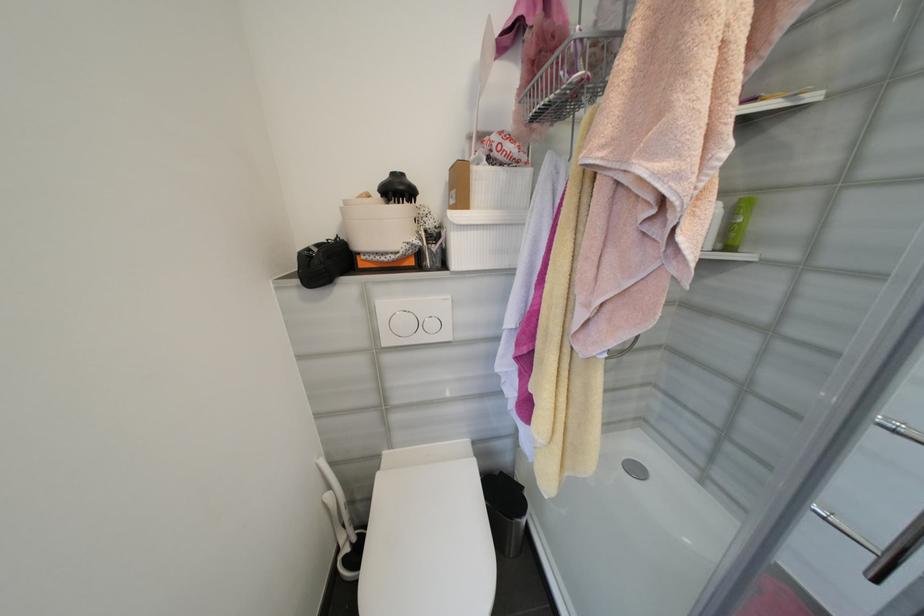
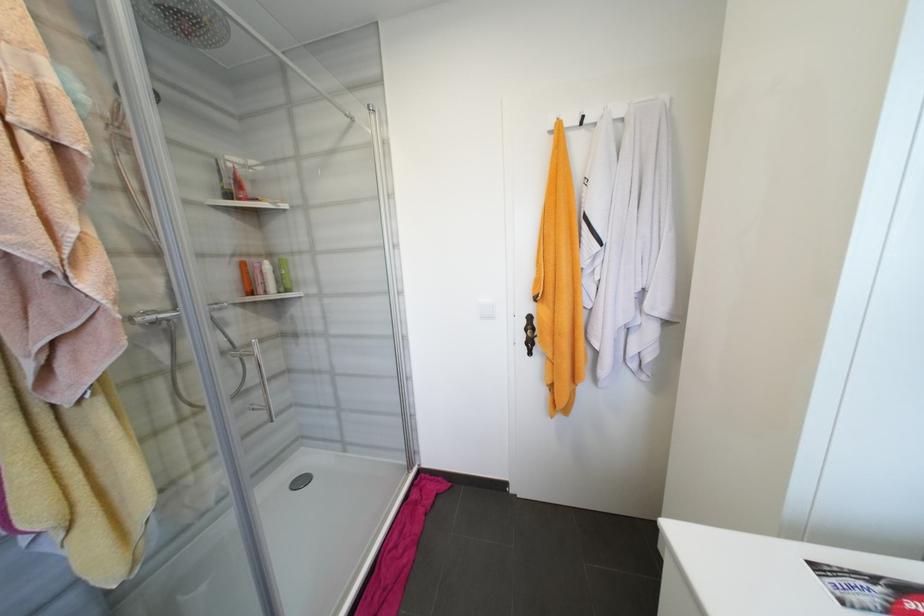
Question: Based on the continuous images, in which direction is the camera rotating? Reply with the corresponding letter.

Choices:
 (A) Left
 (B) Right
 (C) Up
 (D) Down

Answer: (B)